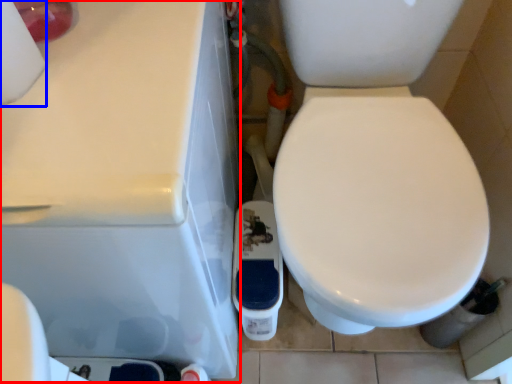
Question: Which object is closer to the camera taking this photo, porcelain (highlighted by a red box) or toilet paper (highlighted by a blue box)?

Choices:
 (A) porcelain
 (B) toilet paper

Answer: (B)